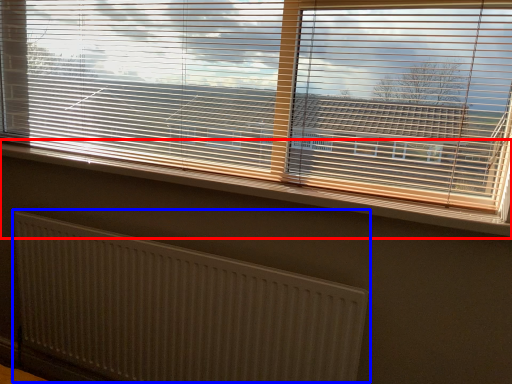
Question: Which point is closer to the camera, window sill (highlighted by a red box) or radiator (highlighted by a blue box)?

Choices:
 (A) window sill
 (B) radiator

Answer: (A)